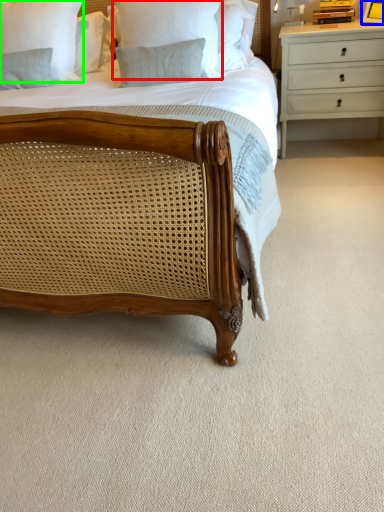
Question: Considering the real-world distances, which object is farthest from pillow (highlighted by a red box)? picture frame (highlighted by a blue box) or pillow (highlighted by a green box)?

Choices:
 (A) picture frame
 (B) pillow

Answer: (A)